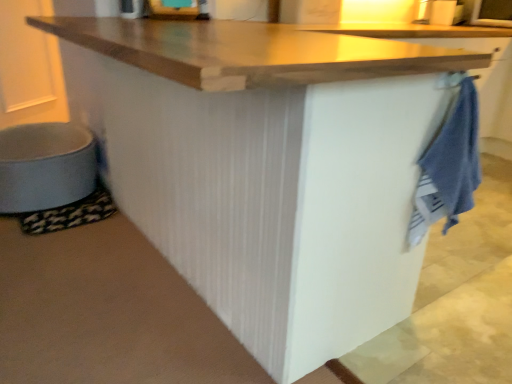
This screenshot has width=512, height=384. Identify the location of matte gray step stool at lower left. (45, 166).

Measure the distance between point (90, 159) and camera.

Point (90, 159) is 7.30 feet from camera.

Image resolution: width=512 pixels, height=384 pixels. What do you see at coordinates (45, 166) in the screenshot?
I see `matte gray step stool at lower left` at bounding box center [45, 166].

In the scene shown: What is the approximate width of blue cotton towel at right?

blue cotton towel at right is 10.60 inches in width.

Image resolution: width=512 pixels, height=384 pixels. Describe the element at coordinates (448, 167) in the screenshot. I see `blue cotton towel at right` at that location.

Where is `blue cotton towel at right`? blue cotton towel at right is located at coordinates (448, 167).

Where is `matte gray step stool at lower left`? The image size is (512, 384). matte gray step stool at lower left is located at coordinates (45, 166).

Considering the relative positions of matte gray step stool at lower left and blue cotton towel at right in the image provided, is matte gray step stool at lower left to the left of blue cotton towel at right from the viewer's perspective?

Correct, you'll find matte gray step stool at lower left to the left of blue cotton towel at right.

Which is in front, matte gray step stool at lower left or blue cotton towel at right?

blue cotton towel at right is more forward.

Which is in front, point (23, 150) or point (460, 164)?

The point (460, 164) is more forward.

From the image's perspective, is matte gray step stool at lower left located above or below blue cotton towel at right?

Clearly, from the image's perspective, matte gray step stool at lower left is above blue cotton towel at right.

From a real-world perspective, which is physically below, matte gray step stool at lower left or blue cotton towel at right?

matte gray step stool at lower left, from a real-world perspective.

Which object is wider, matte gray step stool at lower left or blue cotton towel at right?

With larger width is matte gray step stool at lower left.

Considering the relative sizes of matte gray step stool at lower left and blue cotton towel at right in the image provided, is matte gray step stool at lower left taller than blue cotton towel at right?

No, matte gray step stool at lower left is not taller than blue cotton towel at right.

In terms of size, does matte gray step stool at lower left appear bigger or smaller than blue cotton towel at right?

matte gray step stool at lower left is bigger than blue cotton towel at right.

Is matte gray step stool at lower left completely or partially outside of blue cotton towel at right?

That's correct, matte gray step stool at lower left is outside of blue cotton towel at right.

Is matte gray step stool at lower left not near blue cotton towel at right?

Absolutely, matte gray step stool at lower left is distant from blue cotton towel at right.

Is matte gray step stool at lower left positioned with its back to blue cotton towel at right?

No.

How many degrees apart are the facing directions of matte gray step stool at lower left and blue cotton towel at right?

There is a 5.36-degree angle between the facing directions of matte gray step stool at lower left and blue cotton towel at right.

How distant is matte gray step stool at lower left from blue cotton towel at right?

matte gray step stool at lower left is 1.69 meters from blue cotton towel at right.

Where is `bath towel that is on the right side of matte gray step stool at lower left`? bath towel that is on the right side of matte gray step stool at lower left is located at coordinates (448, 167).

Considering the positions of objects blue cotton towel at right and matte gray step stool at lower left in the image provided, who is more to the right, blue cotton towel at right or matte gray step stool at lower left?

blue cotton towel at right is more to the right.

Considering the positions of objects blue cotton towel at right and matte gray step stool at lower left in the image provided, who is in front, blue cotton towel at right or matte gray step stool at lower left?

Positioned in front is blue cotton towel at right.

Which is nearer, (449, 125) or (56, 169)?

Point (449, 125)

From the image's perspective, is blue cotton towel at right positioned above or below matte gray step stool at lower left?

Clearly, from the image's perspective, blue cotton towel at right is below matte gray step stool at lower left.

From a real-world perspective, is blue cotton towel at right on matte gray step stool at lower left?

Correct, in the physical world, blue cotton towel at right is higher than matte gray step stool at lower left.

Is blue cotton towel at right thinner than matte gray step stool at lower left?

Indeed, blue cotton towel at right has a lesser width compared to matte gray step stool at lower left.

Considering the sizes of objects blue cotton towel at right and matte gray step stool at lower left in the image provided, who is taller, blue cotton towel at right or matte gray step stool at lower left?

With more height is blue cotton towel at right.

Between blue cotton towel at right and matte gray step stool at lower left, which one has smaller size?

With smaller size is blue cotton towel at right.

Is blue cotton towel at right not within matte gray step stool at lower left?

blue cotton towel at right is positioned outside matte gray step stool at lower left.

Looking at this image, is there a large distance between blue cotton towel at right and matte gray step stool at lower left?

Absolutely, blue cotton towel at right is distant from matte gray step stool at lower left.

Is matte gray step stool at lower left at the back of blue cotton towel at right?

No, blue cotton towel at right is not facing away from matte gray step stool at lower left.

How different are the orientations of blue cotton towel at right and matte gray step stool at lower left in degrees?

There is a 5.36-degree angle between the facing directions of blue cotton towel at right and matte gray step stool at lower left.

Measure the distance between blue cotton towel at right and matte gray step stool at lower left.

blue cotton towel at right and matte gray step stool at lower left are 5.56 feet apart from each other.

Find the location of `bath towel to the right of matte gray step stool at lower left`. bath towel to the right of matte gray step stool at lower left is located at coordinates (448, 167).

Identify the location of step stool on the left of blue cotton towel at right. (45, 166).

There is a matte gray step stool at lower left. Where is `bath towel above it (from a real-world perspective)`? The image size is (512, 384). bath towel above it (from a real-world perspective) is located at coordinates (448, 167).